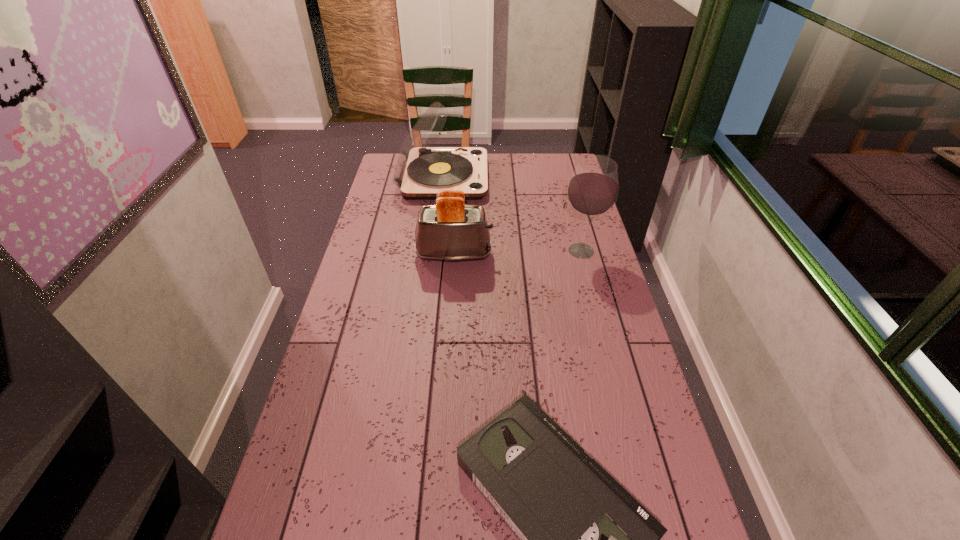
Where is `alcohol`? alcohol is located at coordinates (593, 189).

You are a GUI agent. You are given a task and a screenshot of the screen. Output one action in this format:
    pyautogui.click(x=<x>, y=<y>)
    Task: Click on the record player
    This screenshot has height=540, width=960.
    Given the screenshot: What is the action you would take?
    pyautogui.click(x=421, y=170)

This screenshot has height=540, width=960. I want to click on the third tallest object, so click(450, 231).

This screenshot has width=960, height=540. In order to click on vacant space located 0.190m on the front of the alcohol in this screenshot , I will do `click(595, 305)`.

This screenshot has width=960, height=540. I want to click on free spot located 0.300m with the tonearm facing the front of the record player, so click(x=554, y=178).

At what (x,y) coordinates should I click in order to perform the action: click on vacant space located on the side of the third tallest object with the control lever. Please return your answer as a coordinate pair (x, y). The image size is (960, 540). Looking at the image, I should click on (553, 255).

Find the location of a particular element. object at the far edge is located at coordinates (421, 170).

Where is `object that is at the left edge`? object that is at the left edge is located at coordinates (421, 170).

Find the location of a particular element. The image size is (960, 540). object that is positioned at the right edge is located at coordinates (593, 189).

Where is `object situated at the far left corner`? Image resolution: width=960 pixels, height=540 pixels. object situated at the far left corner is located at coordinates (421, 170).